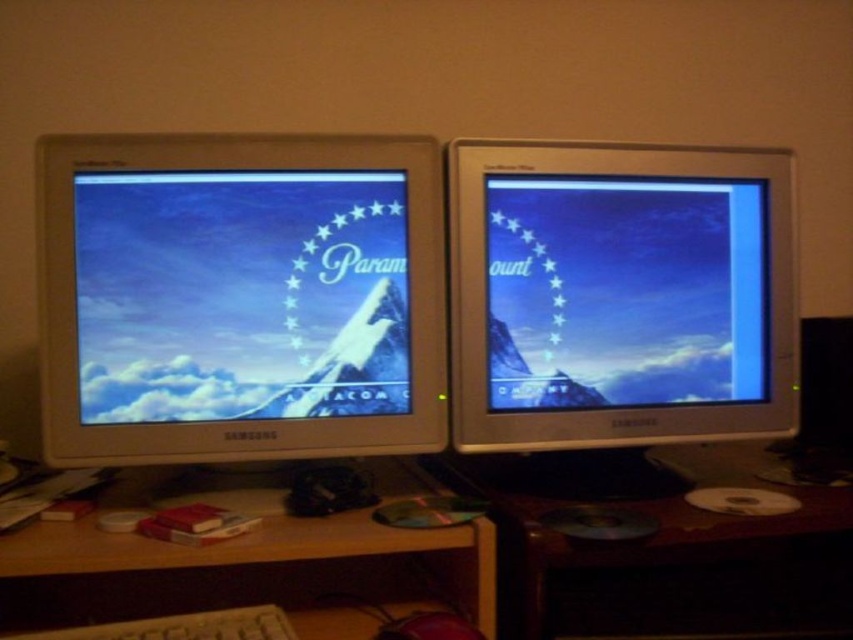
Between white glossy monitor at center and matte silver monitor at right, which one appears on the left side from the viewer's perspective?

white glossy monitor at center

Where is `white glossy monitor at center`? white glossy monitor at center is located at coordinates pos(241,298).

Where is `white glossy monitor at center`? The height and width of the screenshot is (640, 853). white glossy monitor at center is located at coordinates (241, 298).

You are a GUI agent. You are given a task and a screenshot of the screen. Output one action in this format:
    pyautogui.click(x=<x>, y=<y>)
    Task: Click on the matte silver monitor at right
    
    Given the screenshot: What is the action you would take?
    (618, 305)

Is matte silver monitor at right closer to camera compared to wooden at lower left?

No.

Is point (569, 388) positioned after point (457, 602)?

That is True.

Locate an element on the screen. matte silver monitor at right is located at coordinates (618, 305).

The height and width of the screenshot is (640, 853). What do you see at coordinates (241, 298) in the screenshot?
I see `white glossy monitor at center` at bounding box center [241, 298].

What do you see at coordinates (241, 298) in the screenshot?
I see `white glossy monitor at center` at bounding box center [241, 298].

I want to click on white glossy monitor at center, so click(x=241, y=298).